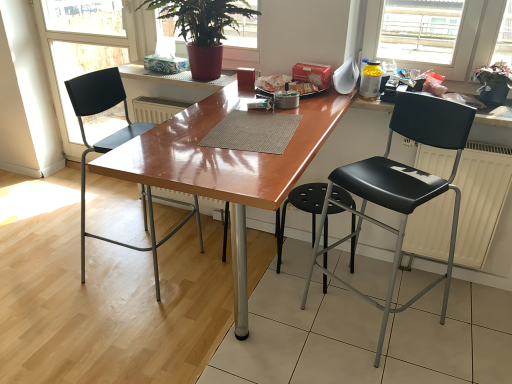
Locate an element on the screen. Image resolution: width=512 pixels, height=384 pixels. vacant area that is in front of black plastic stool at center is located at coordinates (293, 314).